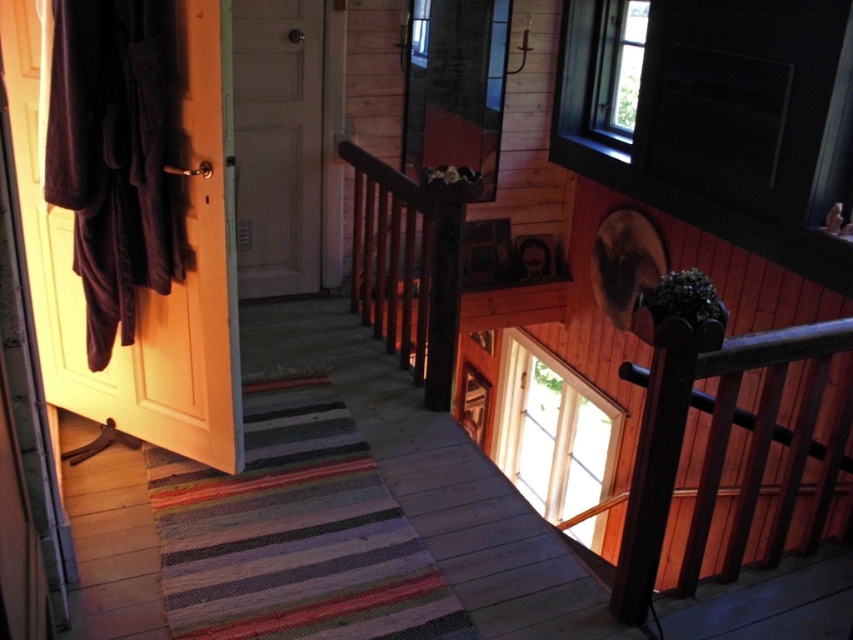
Question: Which object is closer to the camera taking this photo?

Choices:
 (A) white wood door at center
 (B) wooden balustrade at upper right
 (C) brown velvety coat at left

Answer: (B)

Question: Estimate the real-world distances between objects in this image. Which object is farther from the wooden balustrade at upper right?

Choices:
 (A) brown velvety coat at left
 (B) white wood door at center

Answer: (B)

Question: In this image, where is wooden balustrade at upper right located relative to white wood door at center?

Choices:
 (A) below
 (B) above

Answer: (A)

Question: Which of the following is the closest to the observer?

Choices:
 (A) (733, 412)
 (B) (204, 397)
 (C) (293, 212)

Answer: (A)

Question: Can you confirm if wooden balustrade at upper right is bigger than white wood door at center?

Choices:
 (A) no
 (B) yes

Answer: (A)

Question: Is the position of brown velvety coat at left less distant than that of wooden balustrade at upper right?

Choices:
 (A) no
 (B) yes

Answer: (A)